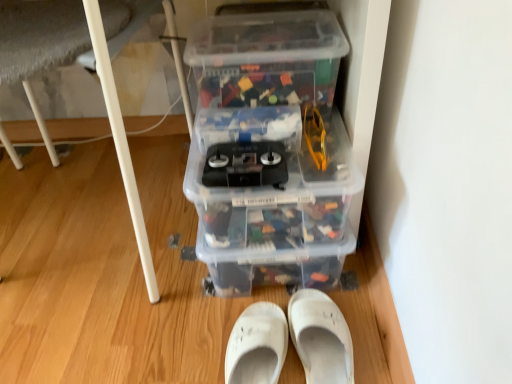
I want to click on white fabric slipper at lower center, positioned as the 2th footwear in left-to-right order, so click(x=321, y=338).

Where is `white fabric slipper at lower center, positioned as the 2th footwear in left-to-right order`? This screenshot has height=384, width=512. white fabric slipper at lower center, positioned as the 2th footwear in left-to-right order is located at coordinates (321, 338).

Could you tell me if transparent plastic storage box at center, positioned as the first storage box in bottom-to-top order, is turned towards white fabric slipper at lower center, positioned as the 2th footwear in left-to-right order?

No, transparent plastic storage box at center, positioned as the first storage box in bottom-to-top order, is not facing towards white fabric slipper at lower center, positioned as the 2th footwear in left-to-right order.

Find the location of a particular element. footwear that is the 1st object located below the transparent plastic storage box at center, positioned as the first storage box in bottom-to-top order (from the image's perspective) is located at coordinates (321, 338).

Is transparent plastic storage box at center, positioned as the first storage box in bottom-to-top order, spatially inside white fabric slipper at lower center, positioned as the 2th footwear in left-to-right order, or outside of it?

The correct answer is: outside.

From the image's perspective, which is below, transparent plastic storage box at center, positioned as the first storage box in bottom-to-top order, or white fabric slipper at lower center, the first footwear in the right-to-left sequence?

white fabric slipper at lower center, the first footwear in the right-to-left sequence, appears lower in the image.

From the image's perspective, is white plastic table leg at lower left over transparent plastic storage box at upper center, positioned as the first storage box in top-to-bottom order?

Incorrect, from the image's perspective, white plastic table leg at lower left is lower than transparent plastic storage box at upper center, positioned as the first storage box in top-to-bottom order.

From a real-world perspective, who is located higher, white plastic table leg at lower left or transparent plastic storage box at upper center, positioned as the first storage box in top-to-bottom order?

In real-world perspective, transparent plastic storage box at upper center, positioned as the first storage box in top-to-bottom order, is above.

Considering the points (147, 287) and (313, 91), which point is in front, point (147, 287) or point (313, 91)?

The point (313, 91) is more forward.

Is the position of white plastic table leg at lower left less distant than that of transparent plastic storage box at upper center, positioned as the first storage box in top-to-bottom order?

That is True.

Does point (147, 288) lie in front of point (241, 283)?

Yes, it is in front of point (241, 283).

Is white plastic table leg at lower left directly adjacent to transparent plastic storage box at center, placed as the 2th storage box when sorted from top to bottom?

There is a gap between white plastic table leg at lower left and transparent plastic storage box at center, placed as the 2th storage box when sorted from top to bottom.

From a real-world perspective, is white plastic table leg at lower left over transparent plastic storage box at center, positioned as the first storage box in bottom-to-top order?

Yes.

Would you consider white fabric slipper at lower center, the first footwear in the right-to-left sequence, to be distant from white plastic table leg at lower left?

No, white fabric slipper at lower center, the first footwear in the right-to-left sequence, is in close proximity to white plastic table leg at lower left.

Is white fabric slipper at lower center, positioned as the 2th footwear in left-to-right order, turned away from white plastic table leg at lower left?

No, white fabric slipper at lower center, positioned as the 2th footwear in left-to-right order,'s orientation is not away from white plastic table leg at lower left.

Where is `the 2nd footwear behind the white plastic table leg at lower left`? the 2nd footwear behind the white plastic table leg at lower left is located at coordinates (321, 338).

Looking at this image, which object is thinner, white plastic table leg at lower left or white matte shoe at lower center, placed as the first footwear when sorted from left to right?

With smaller width is white matte shoe at lower center, placed as the first footwear when sorted from left to right.

From the image's perspective, is white plastic table leg at lower left on top of white matte shoe at lower center, positioned as the second footwear in right-to-left order?

Indeed, from the image's perspective, white plastic table leg at lower left is shown above white matte shoe at lower center, positioned as the second footwear in right-to-left order.

Can you confirm if white plastic table leg at lower left is bigger than white matte shoe at lower center, placed as the first footwear when sorted from left to right?

Yes, white plastic table leg at lower left is bigger than white matte shoe at lower center, placed as the first footwear when sorted from left to right.

Can you confirm if white plastic table leg at lower left is taller than white matte shoe at lower center, positioned as the second footwear in right-to-left order?

Indeed, white plastic table leg at lower left has a greater height compared to white matte shoe at lower center, positioned as the second footwear in right-to-left order.

Does white fabric slipper at lower center, positioned as the 2th footwear in left-to-right order, have a lesser height compared to white matte shoe at lower center, placed as the first footwear when sorted from left to right?

Correct, white fabric slipper at lower center, positioned as the 2th footwear in left-to-right order, is not as tall as white matte shoe at lower center, placed as the first footwear when sorted from left to right.

Consider the image. Can you tell me how much white fabric slipper at lower center, positioned as the 2th footwear in left-to-right order, and white matte shoe at lower center, placed as the first footwear when sorted from left to right, differ in facing direction?

white fabric slipper at lower center, positioned as the 2th footwear in left-to-right order, and white matte shoe at lower center, placed as the first footwear when sorted from left to right, are facing 0.00065 degrees away from each other.

Which object is wider, white fabric slipper at lower center, the first footwear in the right-to-left sequence, or white matte shoe at lower center, positioned as the second footwear in right-to-left order?

Wider between the two is white fabric slipper at lower center, the first footwear in the right-to-left sequence.

In the scene shown: From a real-world perspective, which object stands above the other?

white fabric slipper at lower center, positioned as the 2th footwear in left-to-right order.

How many degrees apart are the facing directions of white matte shoe at lower center, positioned as the second footwear in right-to-left order, and white fabric slipper at lower center, the first footwear in the right-to-left sequence?

The angle between the facing direction of white matte shoe at lower center, positioned as the second footwear in right-to-left order, and the facing direction of white fabric slipper at lower center, the first footwear in the right-to-left sequence, is 0.00065 degrees.

From a real-world perspective, which object stands above the other?

white fabric slipper at lower center, the first footwear in the right-to-left sequence, from a real-world perspective.

Looking at their sizes, would you say white matte shoe at lower center, placed as the first footwear when sorted from left to right, is wider or thinner than white fabric slipper at lower center, positioned as the 2th footwear in left-to-right order?

Clearly, white matte shoe at lower center, placed as the first footwear when sorted from left to right, has less width compared to white fabric slipper at lower center, positioned as the 2th footwear in left-to-right order.

From the white fabric slipper at lower center, positioned as the 2th footwear in left-to-right order, count 1st storage boxs backward and point to it. Please provide its 2D coordinates.

[(270, 150)]

Where is `furniture in front of the transparent plastic storage box at upper center, positioned as the first storage box in top-to-bottom order`? furniture in front of the transparent plastic storage box at upper center, positioned as the first storage box in top-to-bottom order is located at coordinates (120, 140).

Estimate the real-world distances between objects in this image. Which object is closer to white plastic table leg at lower left, white matte shoe at lower center, placed as the first footwear when sorted from left to right, or transparent plastic storage box at upper center, positioned as the first storage box in top-to-bottom order?

The object closer to white plastic table leg at lower left is white matte shoe at lower center, placed as the first footwear when sorted from left to right.

From the image, which object appears to be farther from transparent plastic storage box at upper center, the 2th storage box from the bottom, white matte shoe at lower center, placed as the first footwear when sorted from left to right, or transparent plastic storage box at center, placed as the 2th storage box when sorted from top to bottom?

white matte shoe at lower center, placed as the first footwear when sorted from left to right.

In the scene shown: From the image, which object appears to be nearer to white fabric slipper at lower center, positioned as the 2th footwear in left-to-right order, white matte shoe at lower center, positioned as the second footwear in right-to-left order, or white plastic table leg at lower left?

white matte shoe at lower center, positioned as the second footwear in right-to-left order, is closer to white fabric slipper at lower center, positioned as the 2th footwear in left-to-right order.

Considering their positions, is transparent plastic storage box at center, positioned as the first storage box in bottom-to-top order, positioned further to transparent plastic storage box at upper center, the 2th storage box from the bottom, than white plastic table leg at lower left?

white plastic table leg at lower left lies further to transparent plastic storage box at upper center, the 2th storage box from the bottom, than the other object.

From the image, which object appears to be farther from transparent plastic storage box at center, placed as the 2th storage box when sorted from top to bottom, transparent plastic storage box at upper center, the 2th storage box from the bottom, or white plastic table leg at lower left?

white plastic table leg at lower left lies further to transparent plastic storage box at center, placed as the 2th storage box when sorted from top to bottom, than the other object.

Estimate the real-world distances between objects in this image. Which object is closer to white plastic table leg at lower left, transparent plastic storage box at upper center, positioned as the first storage box in top-to-bottom order, or transparent plastic storage box at center, positioned as the first storage box in bottom-to-top order?

transparent plastic storage box at center, positioned as the first storage box in bottom-to-top order, is positioned closer to the anchor white plastic table leg at lower left.

Looking at the image, which one is located closer to white fabric slipper at lower center, positioned as the 2th footwear in left-to-right order, white matte shoe at lower center, positioned as the second footwear in right-to-left order, or transparent plastic storage box at center, positioned as the first storage box in bottom-to-top order?

The object closer to white fabric slipper at lower center, positioned as the 2th footwear in left-to-right order, is white matte shoe at lower center, positioned as the second footwear in right-to-left order.

Considering their positions, is white matte shoe at lower center, placed as the first footwear when sorted from left to right, positioned further to white fabric slipper at lower center, the first footwear in the right-to-left sequence, than transparent plastic storage box at upper center, the 2th storage box from the bottom?

Based on the image, transparent plastic storage box at upper center, the 2th storage box from the bottom, appears to be further to white fabric slipper at lower center, the first footwear in the right-to-left sequence.

What are the coordinates of `storage box between white plastic table leg at lower left and transparent plastic storage box at center, placed as the 2th storage box when sorted from top to bottom, from left to right` in the screenshot? It's located at (267, 58).

This screenshot has width=512, height=384. I want to click on footwear between transparent plastic storage box at upper center, positioned as the first storage box in top-to-bottom order, and white matte shoe at lower center, positioned as the second footwear in right-to-left order, vertically, so pyautogui.click(x=321, y=338).

Find the location of `footwear between transparent plastic storage box at center, placed as the 2th storage box when sorted from top to bottom, and white matte shoe at lower center, positioned as the second footwear in right-to-left order, in the vertical direction`. footwear between transparent plastic storage box at center, placed as the 2th storage box when sorted from top to bottom, and white matte shoe at lower center, positioned as the second footwear in right-to-left order, in the vertical direction is located at coordinates (321, 338).

Image resolution: width=512 pixels, height=384 pixels. Find the location of `furniture between transparent plastic storage box at upper center, positioned as the first storage box in top-to-bottom order, and white fabric slipper at lower center, positioned as the 2th footwear in left-to-right order, in the up-down direction`. furniture between transparent plastic storage box at upper center, positioned as the first storage box in top-to-bottom order, and white fabric slipper at lower center, positioned as the 2th footwear in left-to-right order, in the up-down direction is located at coordinates (120, 140).